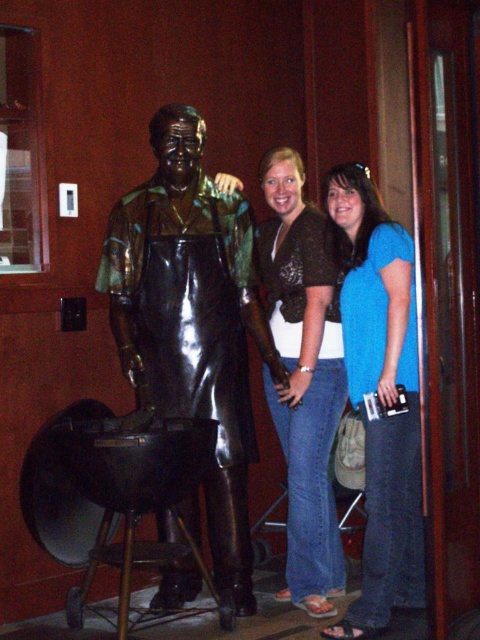
You are a fashion designer observing the two shirts in the image. Which shirt, the blue cotton shirt at center or the brown textured shirt at center, has a shorter length?

The blue cotton shirt at center is shorter than the brown textured shirt at center.

Based on the photo, you are a fashion designer analyzing the image. You need to determine which shirt, the blue cotton shirt at center or the brown textured shirt at center, has a narrower width for designing a similar garment. Which one should you reference?

The blue cotton shirt at center has a narrower width compared to the brown textured shirt at center, so you should reference the blue cotton shirt at center for designing a narrower garment.

You are a photographer trying to capture a group photo of the bronze statue at center and the brown textured shirt at center. If you want to ensure both subjects are fully visible in the frame, which subject should you adjust your camera angle to focus on first?

The bronze statue at center is wider than the brown textured shirt at center, so you should focus on the bronze statue at center first to ensure it fits in the frame before adjusting for the other subject.